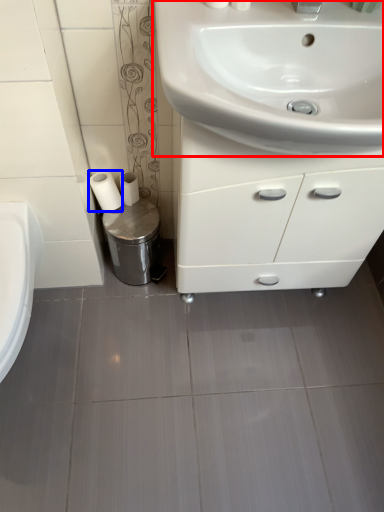
Question: Which object appears closest to the camera in this image, sink (highlighted by a red box) or toilet paper (highlighted by a blue box)?

Choices:
 (A) sink
 (B) toilet paper

Answer: (A)